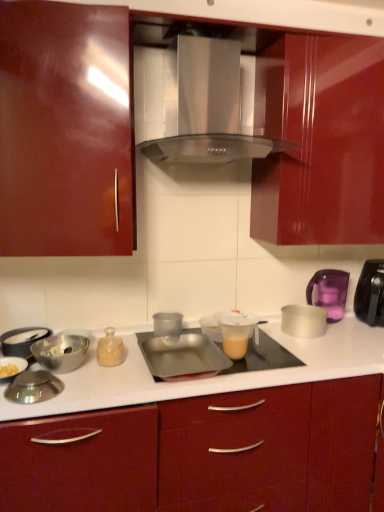
In order to face metallic red cabinet at center, placed as the second cabinetry when sorted from top to bottom, should I rotate leftwards or rightwards?

You should rotate right by 9.262 degrees.

You are a GUI agent. You are given a task and a screenshot of the screen. Output one action in this format:
    pyautogui.click(x=<x>, y=<y>)
    Task: Click on the shiny silver lid at lower left, positioned as the 6th appliance in right-to-left order
    The width and height of the screenshot is (384, 512).
    Given the screenshot: What is the action you would take?
    pyautogui.click(x=33, y=387)

This screenshot has width=384, height=512. What do you see at coordinates (33, 387) in the screenshot?
I see `shiny silver lid at lower left, the third appliance in the left-to-right sequence` at bounding box center [33, 387].

This screenshot has width=384, height=512. Identify the location of glossy wood cabinet at upper center, positioned as the 2th cabinetry in bottom-to-top order. (133, 137).

How much space does purple plastic kettle at right, arranged as the 1th kitchen appliance when viewed from the left, occupy vertically?

purple plastic kettle at right, arranged as the 1th kitchen appliance when viewed from the left, is 26.09 centimeters tall.

The image size is (384, 512). Identify the location of metallic red cabinet at center, which is the 1th cabinetry in bottom-to-top order. (204, 454).

Consider the image. Between silver metallic bowl at right, arranged as the 8th appliance when viewed from the left, and metallic silver tray at center, the 4th appliance from the right, which one has larger size?

metallic silver tray at center, the 4th appliance from the right.

Consider the image. Is silver metallic bowl at right, the first appliance positioned from the right, positioned before metallic silver tray at center, the 4th appliance from the right?

No, it is not.

Could you tell me if silver metallic bowl at right, arranged as the 8th appliance when viewed from the left, is turned towards metallic silver tray at center, the fifth appliance from the left?

No.

Between silver metallic bowl at right, the first appliance positioned from the right, and metallic silver tray at center, the fifth appliance from the left, which one has larger width?

metallic silver tray at center, the fifth appliance from the left.

Is the position of metallic silver tray at center, the 4th appliance from the right, more distant than that of transparent plastic cup at center, the fourth appliance when ordered from left to right?

No, it is in front of transparent plastic cup at center, the fourth appliance when ordered from left to right.

Visually, is metallic silver tray at center, the 4th appliance from the right, positioned to the left or to the right of transparent plastic cup at center, the fourth appliance when ordered from left to right?

In the image, metallic silver tray at center, the 4th appliance from the right, appears on the right side of transparent plastic cup at center, the fourth appliance when ordered from left to right.

Looking at this image, from a real-world perspective, between metallic silver tray at center, the 4th appliance from the right, and transparent plastic cup at center, the 5th appliance when ordered from right to left, who is vertically lower?

From a 3D spatial view, metallic silver tray at center, the 4th appliance from the right, is below.

Is metallic silver tray at center, the fifth appliance from the left, oriented towards transparent plastic cup at center, the fourth appliance when ordered from left to right?

No, metallic silver tray at center, the fifth appliance from the left, is not oriented towards transparent plastic cup at center, the fourth appliance when ordered from left to right.

Is there a large distance between glossy wood cabinet at upper center, positioned as the 1th cabinetry in top-to-bottom order, and satin silver range hood at center?

No, there isn't a large distance between glossy wood cabinet at upper center, positioned as the 1th cabinetry in top-to-bottom order, and satin silver range hood at center.

Locate an element on the screen. This screenshot has width=384, height=512. home appliance positioned vertically above the glossy wood cabinet at upper center, positioned as the 2th cabinetry in bottom-to-top order (from a real-world perspective) is located at coordinates (203, 94).

Does point (28, 113) lie behind point (211, 113)?

No, (28, 113) is in front of (211, 113).

From the picture: From the image's perspective, is glossy wood cabinet at upper center, positioned as the 2th cabinetry in bottom-to-top order, above satin silver range hood at center?

Actually, glossy wood cabinet at upper center, positioned as the 2th cabinetry in bottom-to-top order, appears below satin silver range hood at center in the image.

From a real-world perspective, between metallic silver tray at center, the fifth appliance from the left, and glossy wood cabinet at upper center, positioned as the 2th cabinetry in bottom-to-top order, who is vertically higher?

glossy wood cabinet at upper center, positioned as the 2th cabinetry in bottom-to-top order.

This screenshot has height=512, width=384. Identify the location of cabinetry above the metallic silver tray at center, the 4th appliance from the right (from the image's perspective). (133, 137).

Do you think metallic silver tray at center, the fifth appliance from the left, is within glossy wood cabinet at upper center, positioned as the 1th cabinetry in top-to-bottom order, or outside of it?

metallic silver tray at center, the fifth appliance from the left, cannot be found inside glossy wood cabinet at upper center, positioned as the 1th cabinetry in top-to-bottom order.

Who is taller, metallic silver tray at center, the fifth appliance from the left, or glossy wood cabinet at upper center, positioned as the 2th cabinetry in bottom-to-top order?

glossy wood cabinet at upper center, positioned as the 2th cabinetry in bottom-to-top order.

Which appliance is the 3rd one when counting from the back of the translucent plastic cup at center, arranged as the third appliance when viewed from the right? Please provide its 2D coordinates.

[(168, 326)]

Is transparent plastic cup at center, the fourth appliance when ordered from left to right, inside or outside of translucent plastic cup at center, the sixth appliance when ordered from left to right?

transparent plastic cup at center, the fourth appliance when ordered from left to right, is not enclosed by translucent plastic cup at center, the sixth appliance when ordered from left to right.

Which is more to the left, transparent plastic cup at center, the fourth appliance when ordered from left to right, or translucent plastic cup at center, arranged as the third appliance when viewed from the right?

transparent plastic cup at center, the fourth appliance when ordered from left to right.

Does purple plastic kettle at right, acting as the second kitchen appliance starting from the right, contain transparent plastic cup at center, the 5th appliance when ordered from right to left?

Definitely not — transparent plastic cup at center, the 5th appliance when ordered from right to left, is not inside purple plastic kettle at right, acting as the second kitchen appliance starting from the right.

Are purple plastic kettle at right, acting as the second kitchen appliance starting from the right, and transparent plastic cup at center, the 5th appliance when ordered from right to left, making contact?

No, purple plastic kettle at right, acting as the second kitchen appliance starting from the right, is not with transparent plastic cup at center, the 5th appliance when ordered from right to left.

Which is closer to the camera, (319, 292) or (169, 337)?

Point (319, 292) appears to be farther away from the viewer than point (169, 337).

Looking at this image, is silver metallic bowl at right, arranged as the 8th appliance when viewed from the left, taller than transparent plastic cup at center, the fourth appliance when ordered from left to right?

Yes.

Consider the image. Could you tell me if silver metallic bowl at right, the first appliance positioned from the right, is facing transparent plastic cup at center, the 5th appliance when ordered from right to left?

No, silver metallic bowl at right, the first appliance positioned from the right, does not turn towards transparent plastic cup at center, the 5th appliance when ordered from right to left.

Is silver metallic bowl at right, the first appliance positioned from the right, placed right next to transparent plastic cup at center, the fourth appliance when ordered from left to right?

No, silver metallic bowl at right, the first appliance positioned from the right, is not beside transparent plastic cup at center, the fourth appliance when ordered from left to right.

From the image's perspective, between silver metallic bowl at right, the first appliance positioned from the right, and transparent plastic cup at center, the fourth appliance when ordered from left to right, who is located below?

transparent plastic cup at center, the fourth appliance when ordered from left to right.

From the silver metallic bowl at right, arranged as the 8th appliance when viewed from the left, count 5th appliances forward and point to it. Please provide its 2D coordinates.

[(182, 356)]

Identify the location of the 2nd appliance directly beneath the transparent plastic cup at center, the fourth appliance when ordered from left to right (from a real-world perspective). The height and width of the screenshot is (512, 384). (182, 356).

Based on their spatial positions, is translucent plastic cup at center, the sixth appliance when ordered from left to right, or silver metallic bowl at left further from black plastic toaster at right, acting as the first kitchen appliance starting from the right?

silver metallic bowl at left lies further to black plastic toaster at right, acting as the first kitchen appliance starting from the right, than the other object.

When comparing their distances from purple plastic kettle at right, arranged as the 1th kitchen appliance when viewed from the left, does metallic silver bowl at lower left, which appears as the 2th appliance when viewed from the left, or glossy wood cabinet at upper center, positioned as the 2th cabinetry in bottom-to-top order, seem further?

metallic silver bowl at lower left, which appears as the 2th appliance when viewed from the left, lies further to purple plastic kettle at right, arranged as the 1th kitchen appliance when viewed from the left, than the other object.

Looking at the image, which one is located closer to shiny silver lid at lower left, positioned as the 6th appliance in right-to-left order, silver metallic bowl at left or metallic red cabinet at center, which is the 1th cabinetry in bottom-to-top order?

silver metallic bowl at left.

Estimate the real-world distances between objects in this image. Which object is closer to transparent plastic cup at center, the 5th appliance when ordered from right to left, metallic silver tray at center, the 4th appliance from the right, or purple plastic kettle at right, arranged as the 1th kitchen appliance when viewed from the left?

metallic silver tray at center, the 4th appliance from the right.

In the scene shown: When comparing their distances from metallic silver tray at center, the 4th appliance from the right, does purple plastic kettle at right, arranged as the 1th kitchen appliance when viewed from the left, or shiny silver lid at lower left, positioned as the 6th appliance in right-to-left order, seem further?

purple plastic kettle at right, arranged as the 1th kitchen appliance when viewed from the left, is positioned further to the anchor metallic silver tray at center, the 4th appliance from the right.

Considering their positions, is metallic red cabinet at center, which is the 1th cabinetry in bottom-to-top order, positioned further to black plastic toaster at right, the second kitchen appliance positioned from the left, than satin silver range hood at center?

The object further to black plastic toaster at right, the second kitchen appliance positioned from the left, is satin silver range hood at center.

Based on their spatial positions, is shiny silver lid at lower left, the third appliance in the left-to-right sequence, or glossy wood cabinet at upper center, positioned as the 1th cabinetry in top-to-bottom order, closer to metallic silver pan at left, arranged as the first appliance when viewed from the left?

The object closer to metallic silver pan at left, arranged as the first appliance when viewed from the left, is shiny silver lid at lower left, the third appliance in the left-to-right sequence.

Which object lies nearer to the anchor point metallic silver pan at left, arranged as the 8th appliance when viewed from the right, metallic silver tray at center, the fifth appliance from the left, or metallic red cabinet at center, placed as the second cabinetry when sorted from top to bottom?

metallic silver tray at center, the fifth appliance from the left.

The image size is (384, 512). I want to click on bowl situated between metallic silver pan at left, arranged as the first appliance when viewed from the left, and black plastic toaster at right, acting as the first kitchen appliance starting from the right, from left to right, so click(x=61, y=352).

The width and height of the screenshot is (384, 512). I want to click on bowl positioned between glossy wood cabinet at upper center, positioned as the 2th cabinetry in bottom-to-top order, and metallic silver pan at left, arranged as the first appliance when viewed from the left, from near to far, so click(x=61, y=352).

You are a GUI agent. You are given a task and a screenshot of the screen. Output one action in this format:
    pyautogui.click(x=<x>, y=<y>)
    Task: Click on the cabinetry between glossy wood cabinet at upper center, positioned as the 2th cabinetry in bottom-to-top order, and shiny silver lid at lower left, positioned as the 6th appliance in right-to-left order, from front to back
    The image size is (384, 512).
    Given the screenshot: What is the action you would take?
    pyautogui.click(x=204, y=454)

The width and height of the screenshot is (384, 512). I want to click on bowl located between metallic red cabinet at center, which is the 1th cabinetry in bottom-to-top order, and silver metallic bowl at right, arranged as the 8th appliance when viewed from the left, in the depth direction, so click(61, 352).